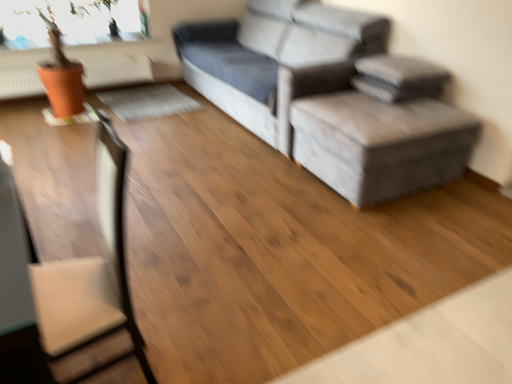
Question: Considering the relative sizes of orange matte radiator at upper left and gray fabric couch at upper right in the image provided, is orange matte radiator at upper left taller than gray fabric couch at upper right?

Choices:
 (A) yes
 (B) no

Answer: (B)

Question: From the image's perspective, is orange matte radiator at upper left on gray fabric couch at upper right?

Choices:
 (A) yes
 (B) no

Answer: (B)

Question: From a real-world perspective, is orange matte radiator at upper left over gray fabric couch at upper right?

Choices:
 (A) no
 (B) yes

Answer: (A)

Question: Can you confirm if orange matte radiator at upper left is bigger than gray fabric couch at upper right?

Choices:
 (A) yes
 (B) no

Answer: (B)

Question: Considering the relative positions of orange matte radiator at upper left and gray fabric couch at upper right in the image provided, is orange matte radiator at upper left to the left of gray fabric couch at upper right from the viewer's perspective?

Choices:
 (A) no
 (B) yes

Answer: (B)

Question: From a real-world perspective, is orange matte radiator at upper left physically below gray fabric couch at upper right?

Choices:
 (A) no
 (B) yes

Answer: (B)

Question: Can you confirm if orange matte radiator at upper left is thinner than brown leather swivel chair at left?

Choices:
 (A) no
 (B) yes

Answer: (B)

Question: Can you confirm if orange matte radiator at upper left is positioned to the right of brown leather swivel chair at left?

Choices:
 (A) no
 (B) yes

Answer: (A)

Question: Is orange matte radiator at upper left at the left side of brown leather swivel chair at left?

Choices:
 (A) no
 (B) yes

Answer: (B)

Question: Is orange matte radiator at upper left surrounding brown leather swivel chair at left?

Choices:
 (A) yes
 (B) no

Answer: (B)

Question: Does orange matte radiator at upper left have a smaller size compared to brown leather swivel chair at left?

Choices:
 (A) no
 (B) yes

Answer: (B)

Question: From a real-world perspective, is orange matte radiator at upper left over brown leather swivel chair at left?

Choices:
 (A) no
 (B) yes

Answer: (A)

Question: Considering the relative sizes of gray fabric ottoman at center and gray fabric couch at upper right in the image provided, is gray fabric ottoman at center thinner than gray fabric couch at upper right?

Choices:
 (A) yes
 (B) no

Answer: (A)